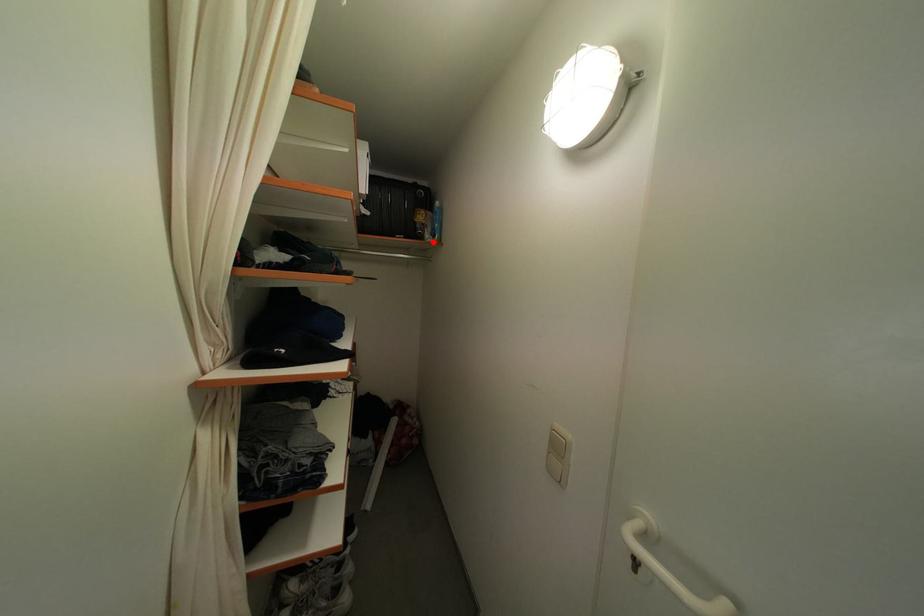
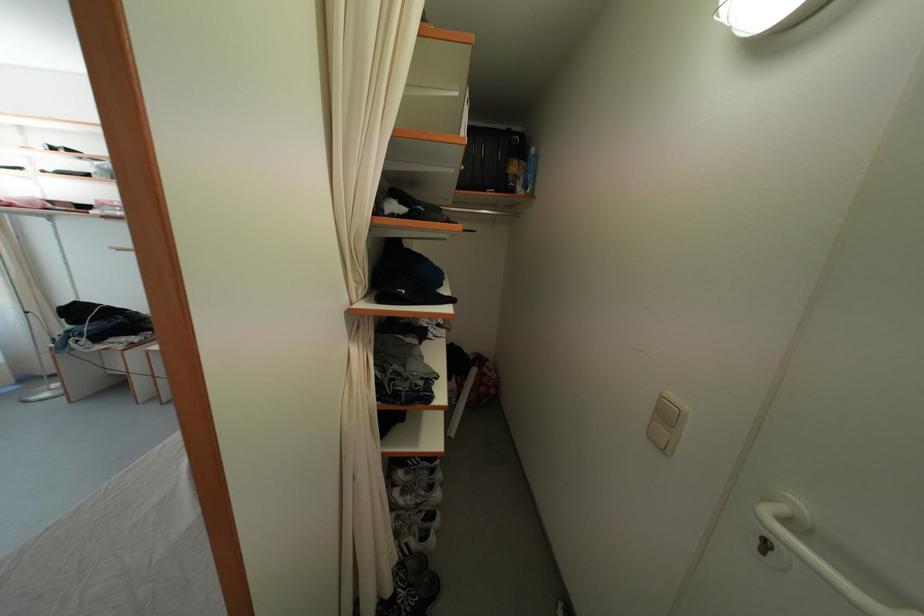
Locate, in the second image, the point that corresponds to the highlighted location in the first image.

(525, 195)